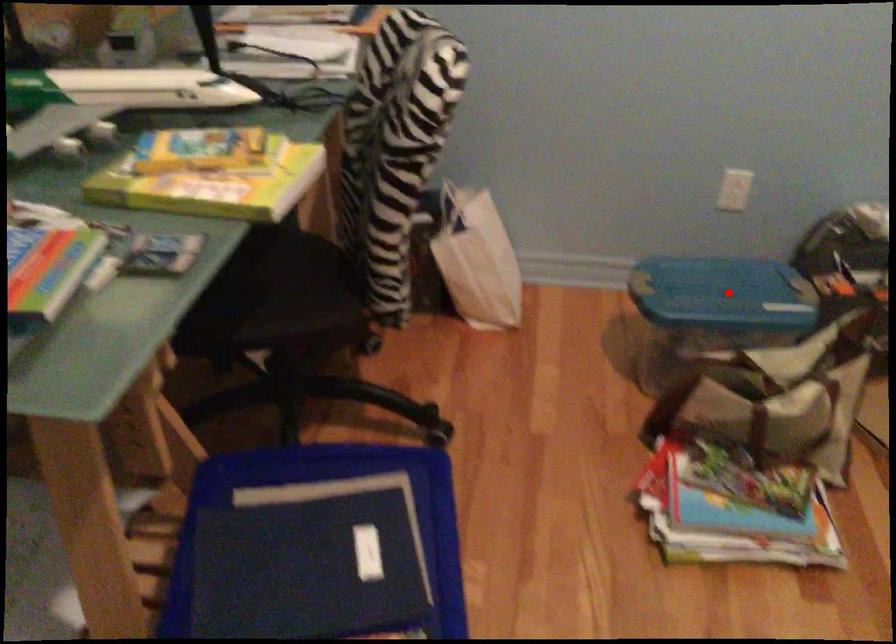
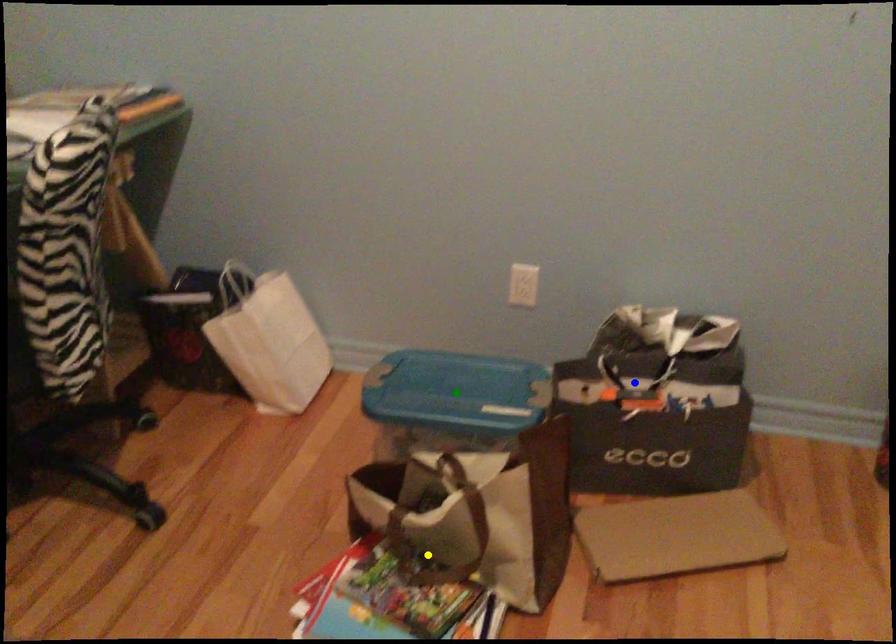
Question: I am providing you with two images of the same scene from different viewpoints. A red point is marked on the first image. You are given multiple points on the second image. Which spot in image 2 lines up with the point in image 1?

Choices:
 (A) green point
 (B) yellow point
 (C) blue point

Answer: (A)